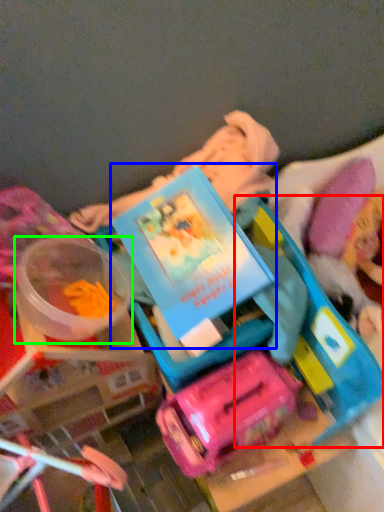
Question: Considering the real-world distances, which object is farthest from toy (highlighted by a red box)? book (highlighted by a blue box) or toy (highlighted by a green box)?

Choices:
 (A) book
 (B) toy

Answer: (B)